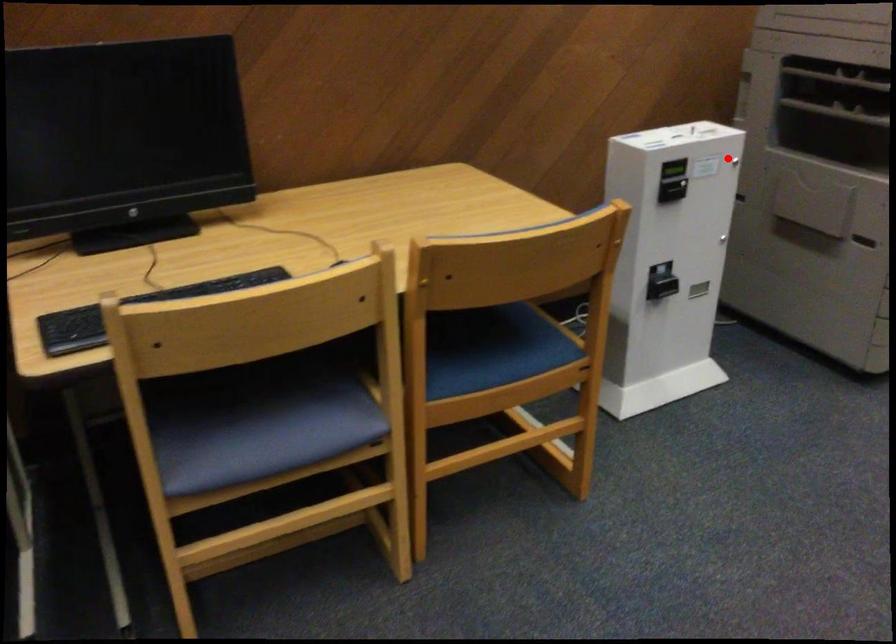
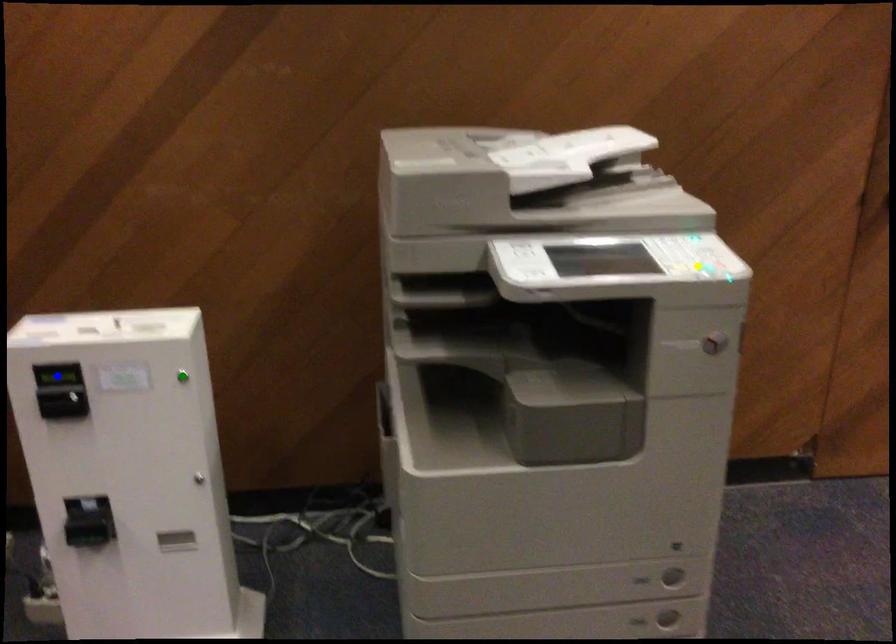
Question: I am providing you with two images of the same scene from different viewpoints. A red point is marked on the first image. You are given multiple points on the second image. Can you choose the point in image 2 that corresponds to the point in image 1?

Choices:
 (A) blue point
 (B) yellow point
 (C) green point

Answer: (C)